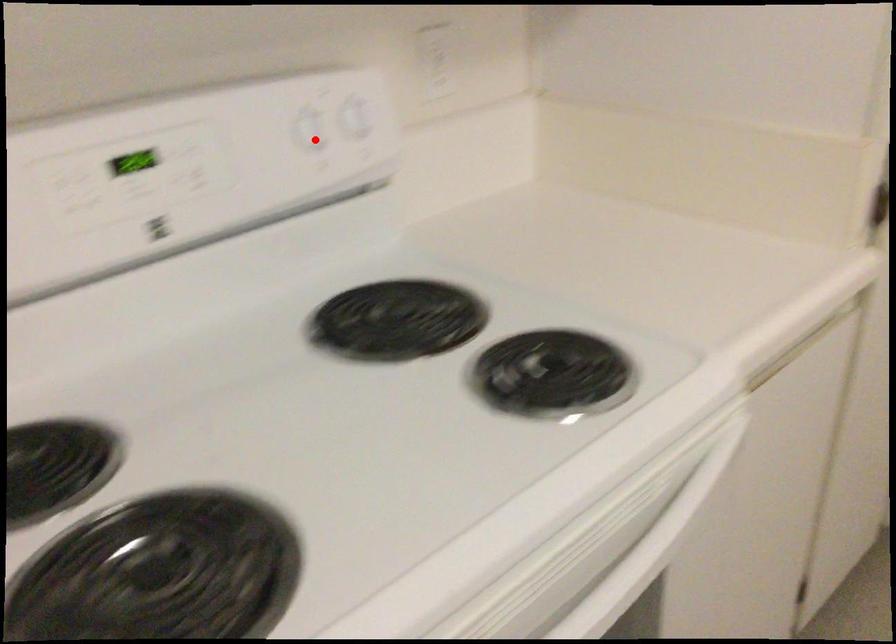
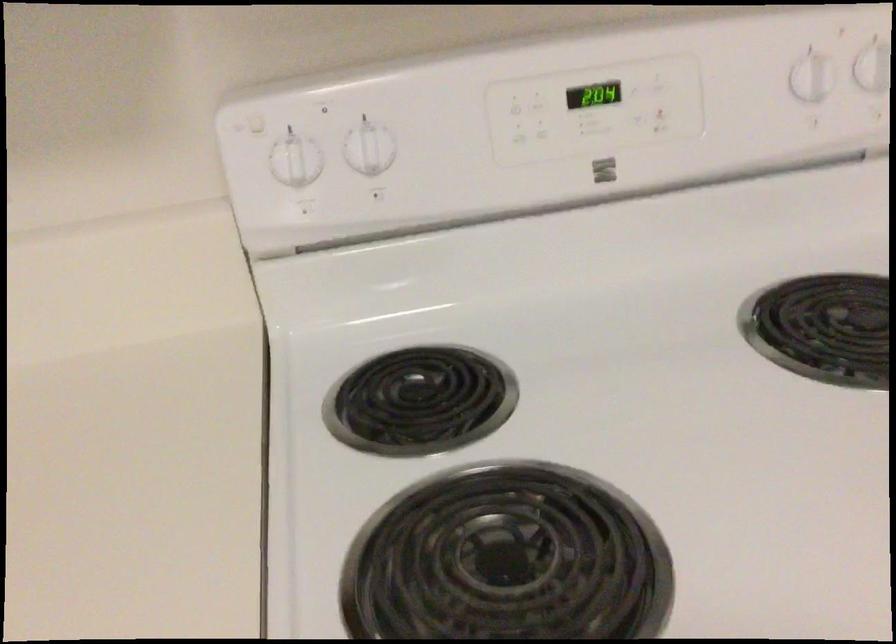
The point at the highlighted location is marked in the first image. Where is the corresponding point in the second image?

(810, 77)